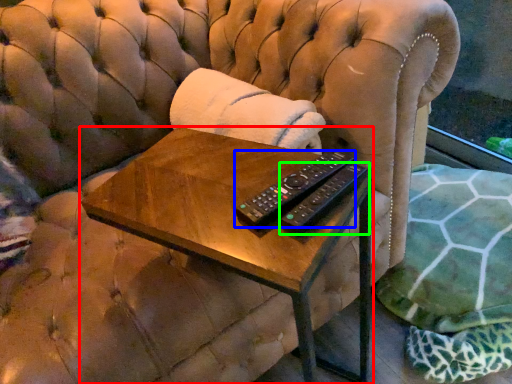
Question: Which object is the closest to the table (highlighted by a red box)? Choose among these: remote control (highlighted by a blue box) or remote control (highlighted by a green box).

Choices:
 (A) remote control
 (B) remote control

Answer: (A)